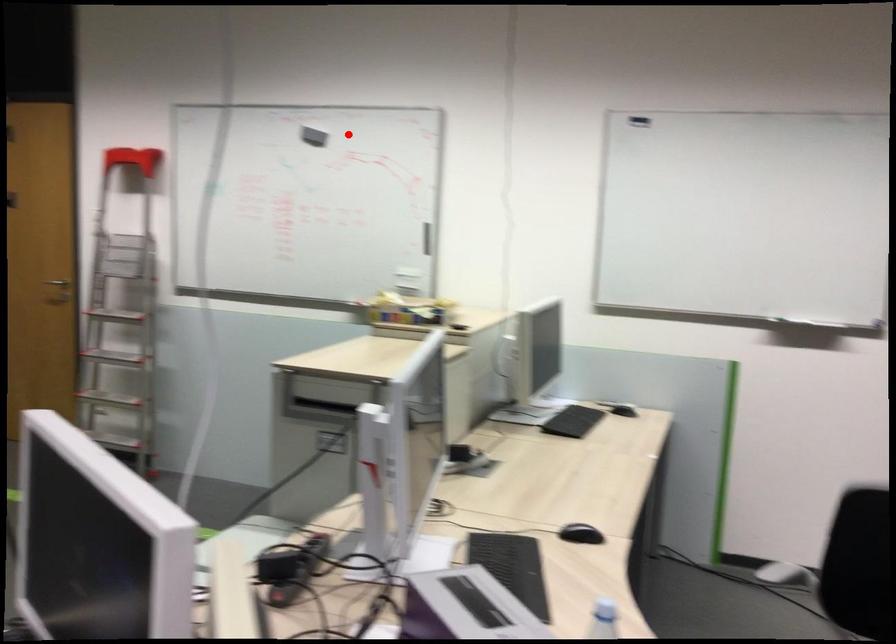
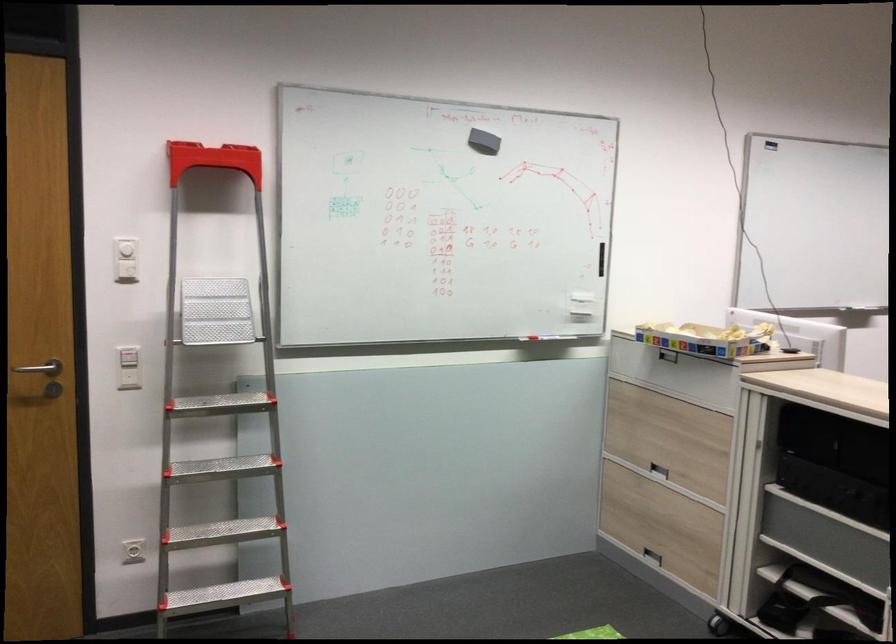
Locate, in the second image, the point that corresponds to the highlighted location in the first image.

(483, 142)